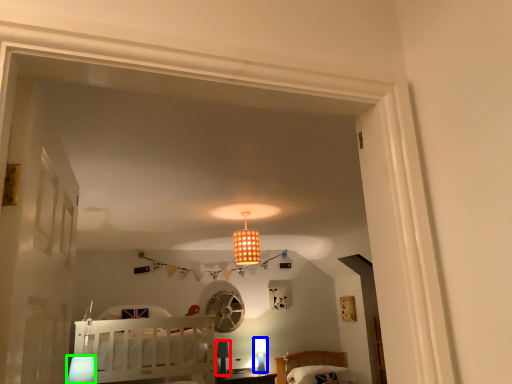
Question: Based on their relative distances, which object is nearer to lamp (highlighted by a red box)? Choose from lamp (highlighted by a blue box) and lamp (highlighted by a green box).

Choices:
 (A) lamp
 (B) lamp

Answer: (A)